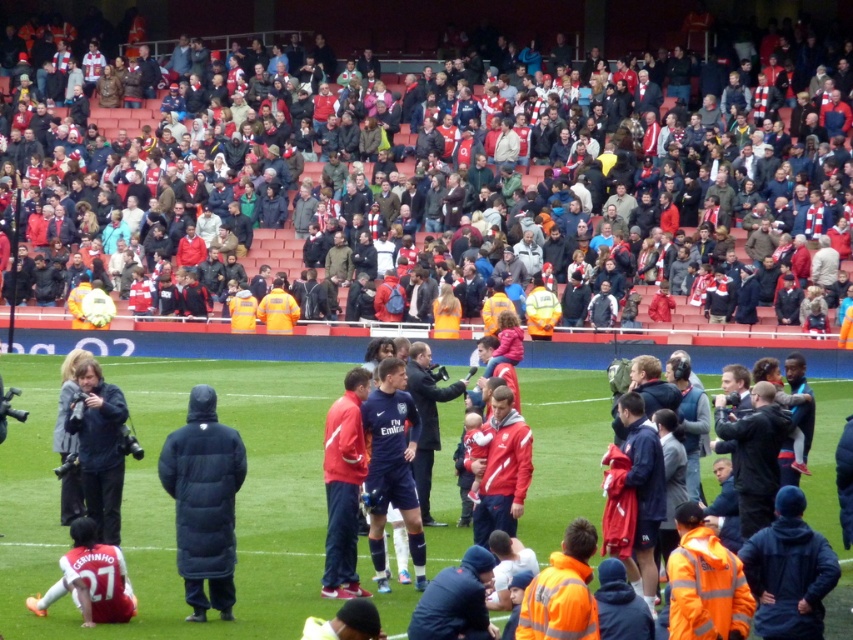
Is dark blue puffer jacket at center to the right of dark gray puffer jacket at lower left from the viewer's perspective?

Correct, you'll find dark blue puffer jacket at center to the right of dark gray puffer jacket at lower left.

Who is more distant from viewer, (225, 435) or (93, 397)?

Positioned behind is point (93, 397).

Image resolution: width=853 pixels, height=640 pixels. What do you see at coordinates (204, 500) in the screenshot?
I see `dark blue puffer jacket at center` at bounding box center [204, 500].

I want to click on dark blue puffer jacket at center, so click(204, 500).

From the picture: Is red fabric scarf at upper center shorter than dark gray puffer jacket at lower left?

In fact, red fabric scarf at upper center may be taller than dark gray puffer jacket at lower left.

Who is shorter, red fabric scarf at upper center or dark gray puffer jacket at lower left?

dark gray puffer jacket at lower left is shorter.

Is point (770, 20) closer to viewer compared to point (70, 422)?

No, it is behind (70, 422).

In order to click on red fabric scarf at upper center in this screenshot , I will do `click(521, 28)`.

Which of these two, red fabric scarf at upper center or white jersey at lower left, stands shorter?

white jersey at lower left is shorter.

I want to click on red fabric scarf at upper center, so click(521, 28).